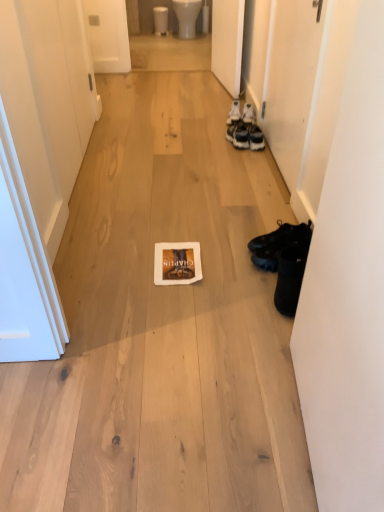
Identify the location of free point behind white leather sneakers at right, the 1th footwear from the back. (217, 105).